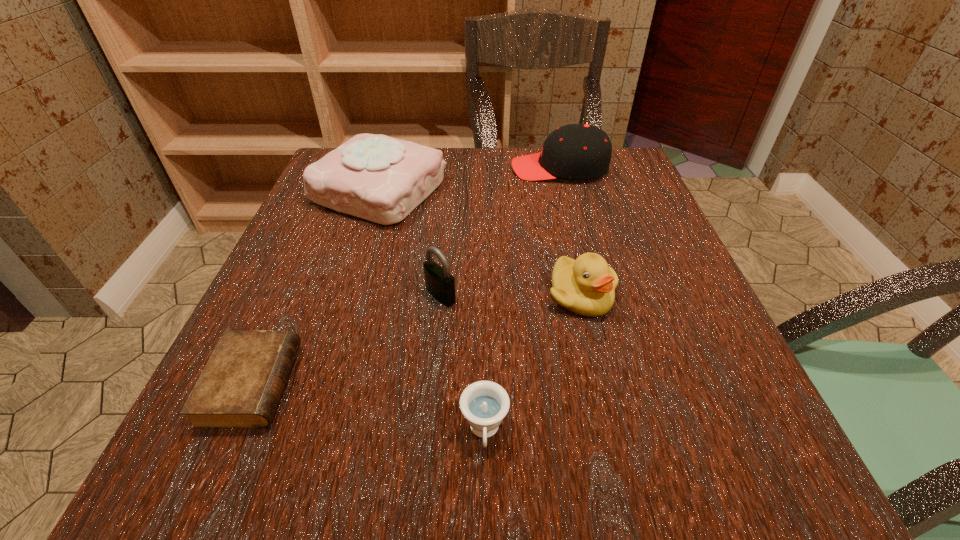
Identify the location of cap. (575, 151).

Image resolution: width=960 pixels, height=540 pixels. I want to click on cake, so click(378, 178).

Identify the location of padlock. (439, 282).

Find the location of a particular element. duckling is located at coordinates (586, 286).

Identify the location of teacup. (484, 404).

I want to click on the fifth tallest object, so click(484, 404).

Locate an element on the screen. This screenshot has height=540, width=960. the shortest object is located at coordinates (240, 387).

Identify the location of vacant space located on the front-facing side of the cap. (445, 168).

I want to click on vacant space situated on the front-facing side of the cap, so click(x=354, y=168).

The image size is (960, 540). Identify the location of free space located on the front-facing side of the cap. (412, 168).